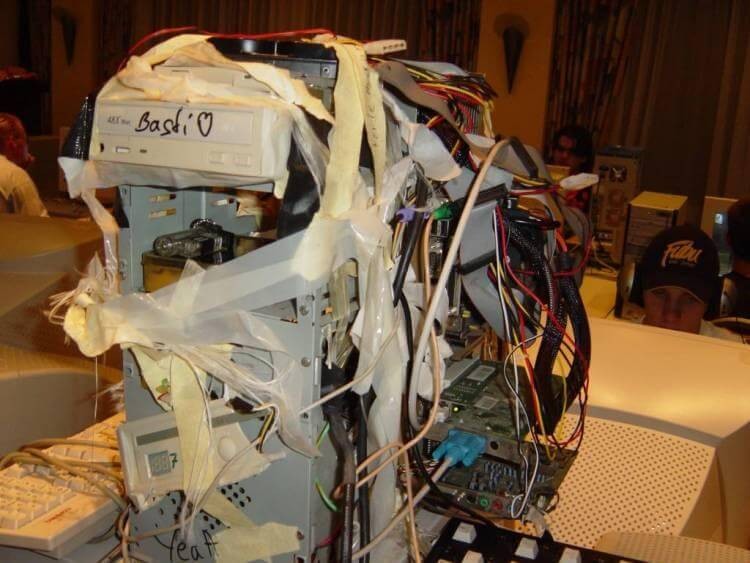
Where is `modem`? modem is located at coordinates (614, 160), (654, 211), (291, 484).